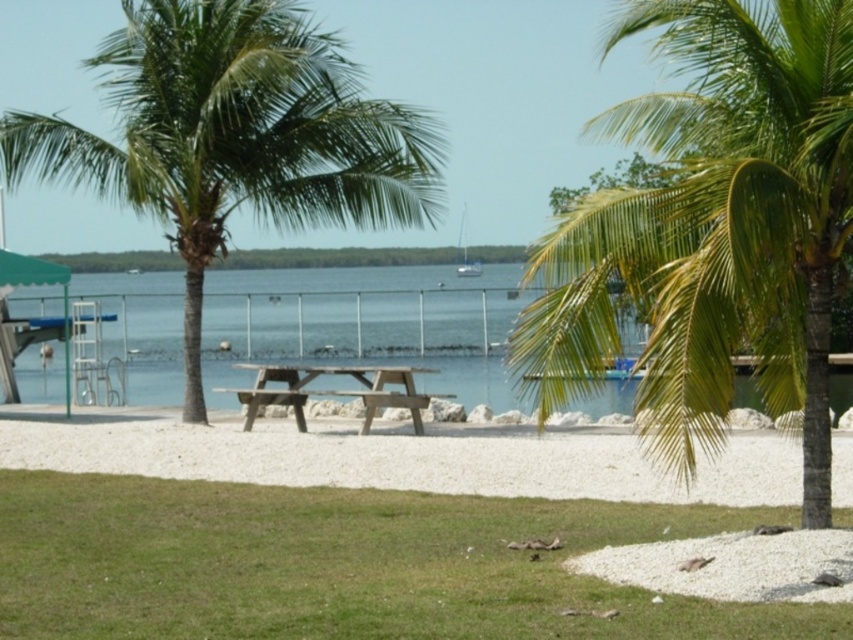
You are standing at the picnic table and want to walk towards the green leafy palm tree at center. Which direction should you head?

The green leafy palm tree at center is located at point (234, 136), so you should head towards that coordinate to reach it.

In the scene shown: You are planning to set up a picnic blanket on the beach. You see the clear blue water at center and the brown wooden picnic table at center. Which object is closer to the water? Please explain your reasoning based on their positions.

The clear blue water at center is positioned over the brown wooden picnic table at center, meaning the water is closer to the viewer and thus closer to the picnic area. To set up the blanket near the water, you would place it between the picnic table and the water.

You are standing at the beach and see the green leafy palm tree at upper right and the white gravel at center. Which object is located to the right side of the other?

The green leafy palm tree at upper right is to the right of the white gravel at center.